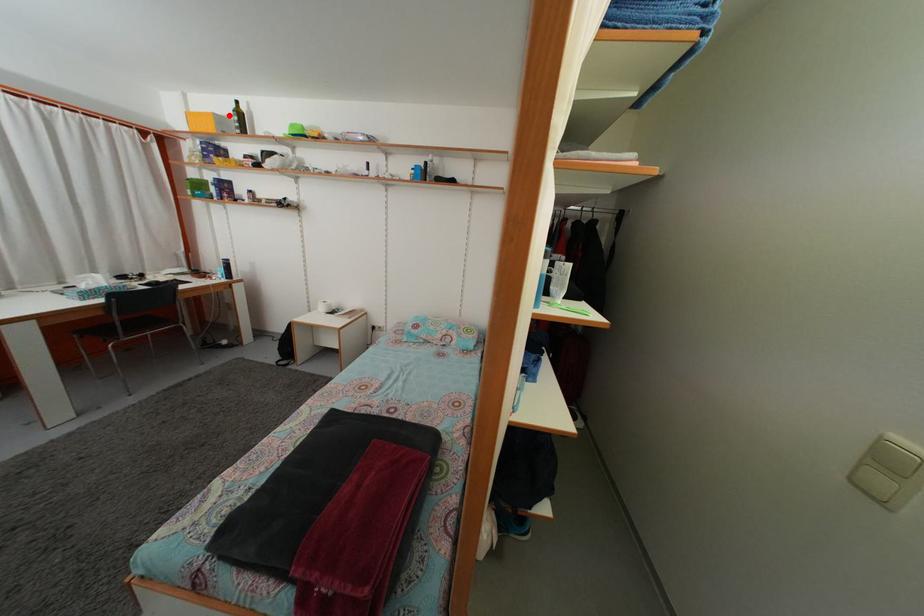
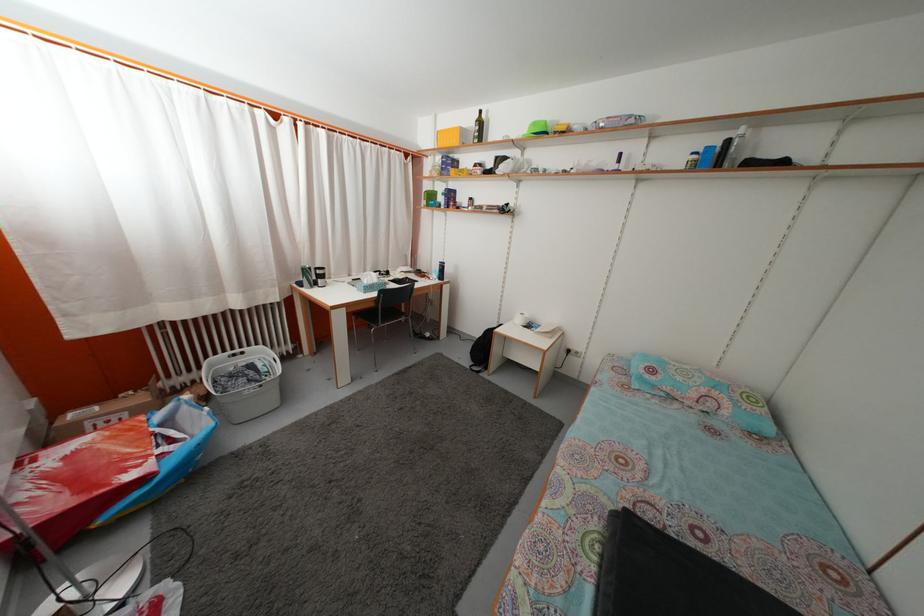
Find the pixel in the second image that matches the highlighted location in the first image.

(475, 127)